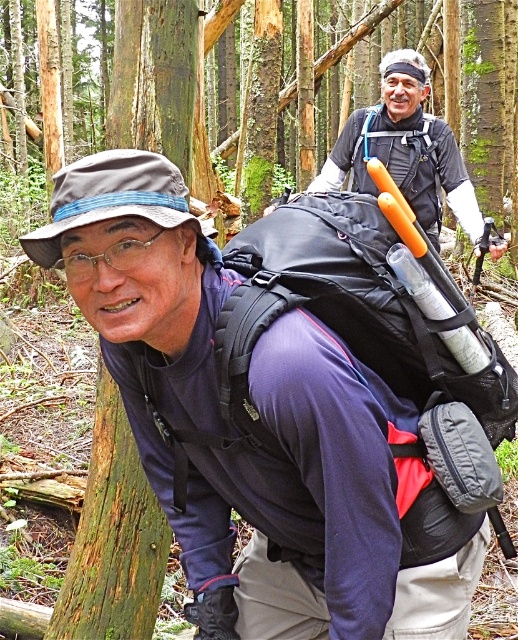
Question: Does matte black backpack at center appear on the left side of black fabric backpack at center?

Choices:
 (A) no
 (B) yes

Answer: (B)

Question: In this image, where is matte black backpack at center located relative to black fabric backpack at center?

Choices:
 (A) below
 (B) above

Answer: (A)

Question: Is matte black backpack at center below black fabric backpack at center?

Choices:
 (A) yes
 (B) no

Answer: (A)

Question: Which point appears farthest from the camera in this image?

Choices:
 (A) (237, 314)
 (B) (71, 195)

Answer: (A)